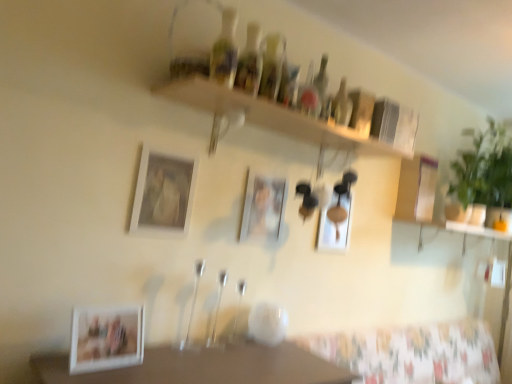
Question: From a real-world perspective, is green leafy plant at right physically located above or below matte white picture frame at center, which is counted as the first picture frame, starting from the back?

Choices:
 (A) above
 (B) below

Answer: (A)

Question: Is green leafy plant at right inside or outside of matte white picture frame at center, the fourth picture frame viewed from the left?

Choices:
 (A) outside
 (B) inside

Answer: (A)

Question: Considering the real-world distances, which object is farthest from the matte white picture frame at upper center, positioned as the second picture frame in left-to-right order?

Choices:
 (A) white matte picture frame at lower left, arranged as the first picture frame when viewed from the front
 (B) translucent glass bottle at upper center, marked as the 5th bottle in a left-to-right arrangement
 (C) matte silver picture frame at center, which is the 2th picture frame in right-to-left order
 (D) translucent glass bottles at upper center, marked as the fourth bottle in a right-to-left arrangement
 (E) green leafy plant at right

Answer: (E)

Question: Considering the real-world distances, which object is closest to the white matte picture frame at lower left, which is the first picture frame from left to right?

Choices:
 (A) translucent glass bottle at upper center, the 2th bottle from the back
 (B) matte white picture frame at center, which appears as the 4th picture frame when viewed from the front
 (C) matte white picture frame at upper center, positioned as the second picture frame in left-to-right order
 (D) green leafy plant at right
 (E) matte silver picture frame at center, which is the 2th picture frame in right-to-left order

Answer: (C)